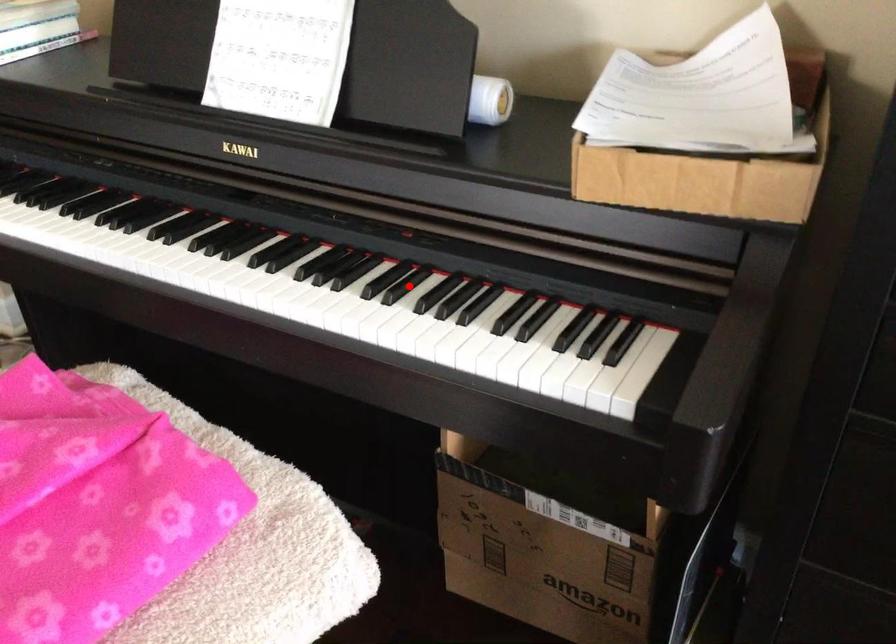
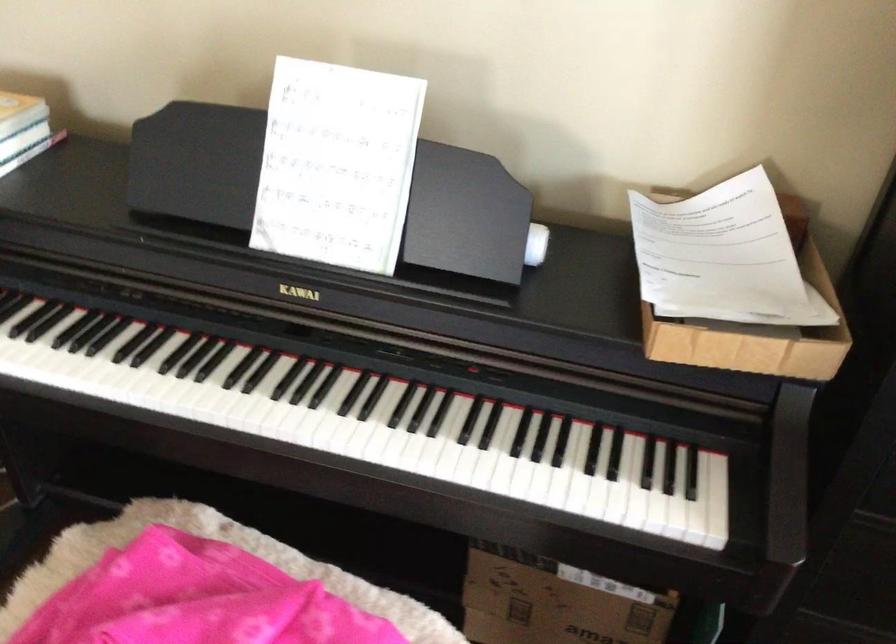
In the second image, find the point that corresponds to the highlighted location in the first image.

(489, 424)